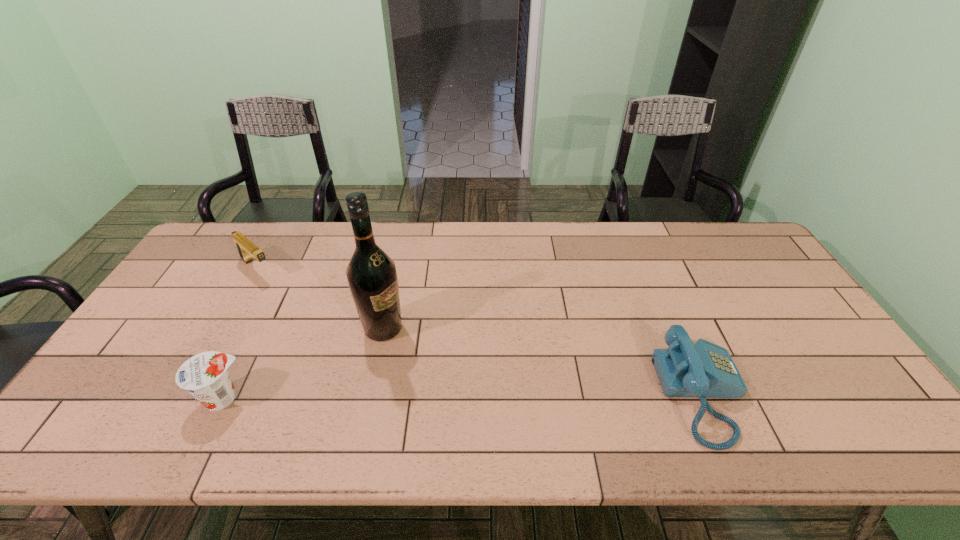
The image size is (960, 540). Find the location of `vacant space in between the third object from left to right and the yogurt`. vacant space in between the third object from left to right and the yogurt is located at coordinates pos(303,363).

Where is `blank region between the yogurt and the telephone`? The width and height of the screenshot is (960, 540). blank region between the yogurt and the telephone is located at coordinates (463, 396).

The image size is (960, 540). Find the location of `free space between the telephone and the wine bottle`. free space between the telephone and the wine bottle is located at coordinates (543, 361).

Where is `unoccupied position between the telephone and the second farthest object`? This screenshot has height=540, width=960. unoccupied position between the telephone and the second farthest object is located at coordinates (543, 361).

The height and width of the screenshot is (540, 960). I want to click on object that ranks as the second closest to the telephone, so click(205, 376).

You are a GUI agent. You are given a task and a screenshot of the screen. Output one action in this format:
    pyautogui.click(x=<x>, y=<y>)
    Task: Click on the second closest object to the rightmost object
    
    Given the screenshot: What is the action you would take?
    pyautogui.click(x=205, y=376)

This screenshot has width=960, height=540. In order to click on free space that satisfies the following two spatial constraints: 1. on the front side of the third nearest object; 2. on the right side of the farthest object in this screenshot , I will do `click(223, 328)`.

This screenshot has height=540, width=960. What are the coordinates of `vacant point that satisfies the following two spatial constraints: 1. on the front side of the pistol; 2. on the dial of the telephone` in the screenshot? It's located at (185, 394).